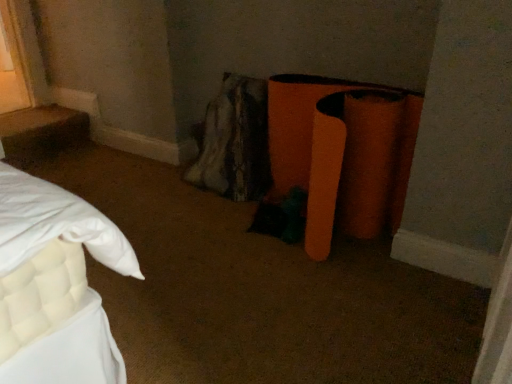
This screenshot has height=384, width=512. What are the coordinates of `vacant area situated to the left side of orange matte stool at lower right` in the screenshot? It's located at (186, 245).